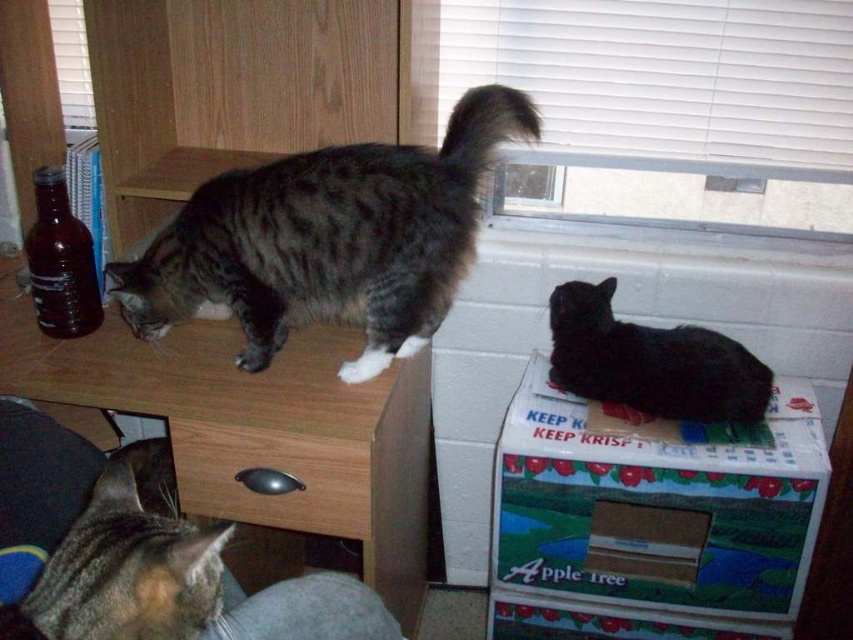
Question: Which point is closer to the camera?

Choices:
 (A) (276, 241)
 (B) (291, 408)
 (C) (306, 454)
 (D) (753, 476)

Answer: (C)

Question: Is cardboard box at lower right wider than black matte/black fur cat at lower right?

Choices:
 (A) yes
 (B) no

Answer: (A)

Question: Which of the following is the farthest from the observer?

Choices:
 (A) tabby fur cat at lower left
 (B) black matte/black fur cat at lower right

Answer: (B)

Question: Which point is closer to the camera?

Choices:
 (A) brushed metal drawer at lower center
 (B) black matte/black fur cat at lower right

Answer: (A)

Question: Where is tabby fur cat at lower left located in relation to black matte/black fur cat at lower right in the image?

Choices:
 (A) left
 (B) right

Answer: (A)

Question: Is the position of wooden at left less distant than that of black matte/black fur cat at lower right?

Choices:
 (A) yes
 (B) no

Answer: (A)